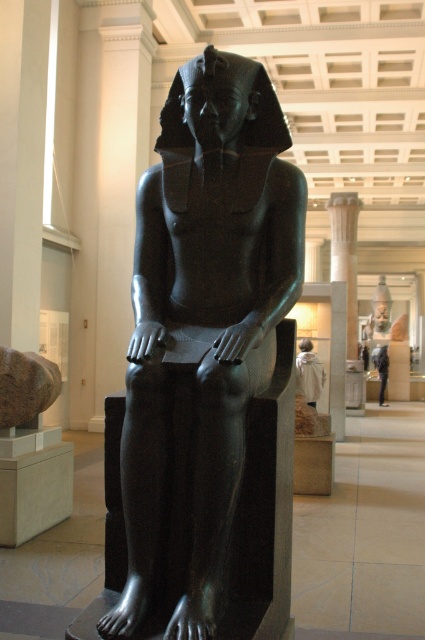
Question: Which point appears closest to the camera in this image?

Choices:
 (A) (229, 113)
 (B) (379, 388)

Answer: (A)

Question: Does polished black statue at center appear on the left side of light blue fabric at center?

Choices:
 (A) no
 (B) yes

Answer: (B)

Question: Does white cotton shirt at center appear under light blue fabric at center?

Choices:
 (A) no
 (B) yes

Answer: (A)

Question: Which of the following is the closest to the observer?

Choices:
 (A) polished black statue at center
 (B) light blue fabric at center
 (C) white cotton shirt at center

Answer: (A)

Question: Is white cotton shirt at center positioned behind light blue fabric at center?

Choices:
 (A) no
 (B) yes

Answer: (A)

Question: Among these objects, which one is nearest to the camera?

Choices:
 (A) light blue fabric at center
 (B) white cotton shirt at center
 (C) polished black statue at center

Answer: (C)